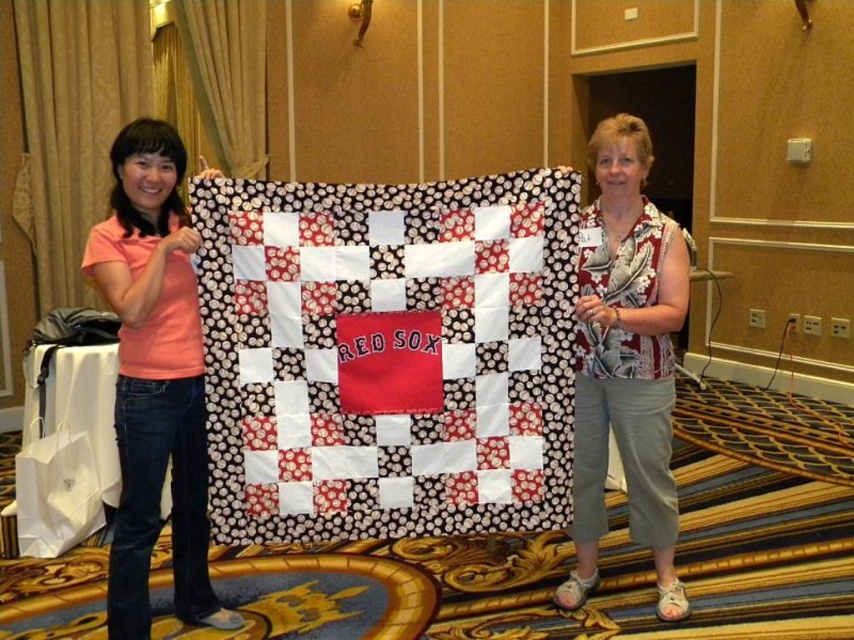
You are standing in front of the quilt and want to reach a point that is exactly 7 feet away from you. Can you determine if the point labeled as point (360, 198) is exactly 7 feet away from your current position?

Yes, the point labeled as point (360, 198) is exactly 7.00 feet away from the viewer, so you can reach that point by moving directly to it.

You are a photographer setting up for a photo shoot. You need to ensure that the red fabric quilt at center is visible in the frame without being blocked by the pink cotton shirt at left. Based on their positions, can you confirm if the quilt will be visible?

The red fabric quilt at center is located above the pink cotton shirt at left, so it will be visible in the frame as it is positioned higher and not blocked by the shirt.

You are a photographer taking a picture of the two people holding the quilt. You want to ensure that both the pink cotton shirt at left and the printed fabric blouse at center are clearly visible in the photo. Based on their positions, which clothing item will appear closer to the camera?

The pink cotton shirt at left will appear closer to the camera because it is in front of the printed fabric blouse at center.